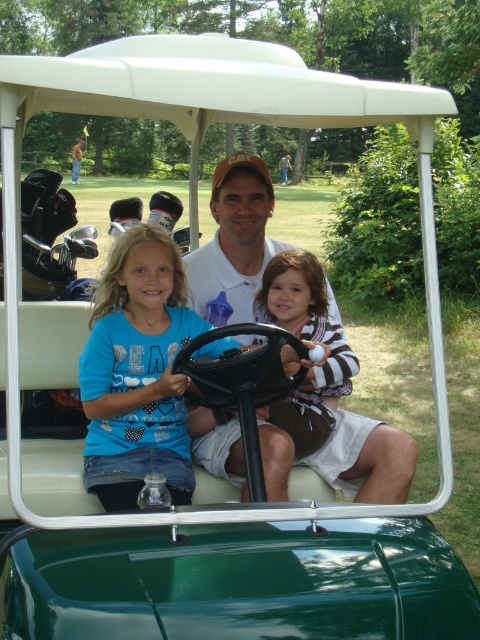
You are a photographer standing near the golf cart. You need to take a photo of the blue cotton shirt at center and the striped fabric ball at center. Which object should you focus on first if you want to capture both in a single frame without moving the camera?

You should focus on the blue cotton shirt at center first because it is taller than the striped fabric ball at center, ensuring it fits within the frame properly.

You are a photographer trying to capture a closeup of the matte white shirt at center and the striped fabric ball at center. Which object should you zoom in on to ensure both are in focus without moving the camera?

The matte white shirt at center occupies less space than the striped fabric ball at center, so you should zoom in on the striped fabric ball at center to ensure both are in focus without moving the camera.

You are trying to locate a specific point in the image. The point is at coordinates (137, 371). Based on the scene description, which object does this point lie on?

The point at coordinates (137, 371) is on the blue cotton shirt at center.